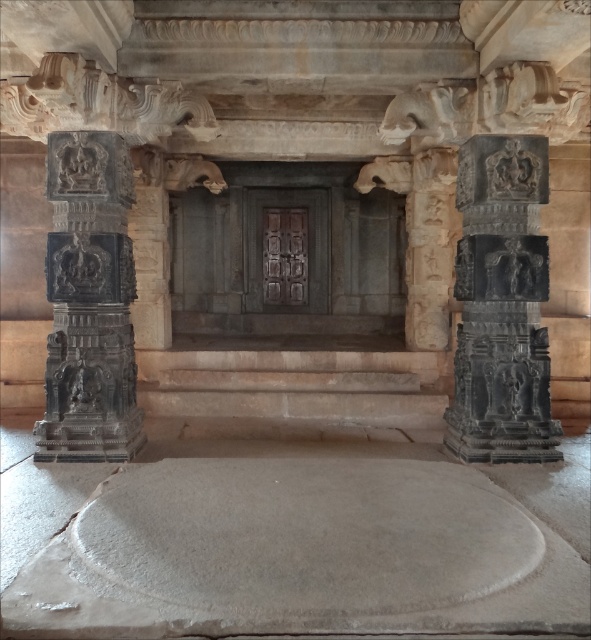
Question: Among these points, which one is farthest from the camera?

Choices:
 (A) (111, 360)
 (B) (462, 321)

Answer: (B)

Question: Where is dark gray stone column at right located in relation to black stone statue at left in the image?

Choices:
 (A) above
 (B) below

Answer: (B)

Question: Can you confirm if dark gray stone column at right is positioned below black stone statue at left?

Choices:
 (A) yes
 (B) no

Answer: (A)

Question: Is dark gray stone column at right to the right of black stone statue at left from the viewer's perspective?

Choices:
 (A) no
 (B) yes

Answer: (B)

Question: Which of the following is the farthest from the observer?

Choices:
 (A) dark gray stone column at right
 (B) black stone statue at left

Answer: (A)